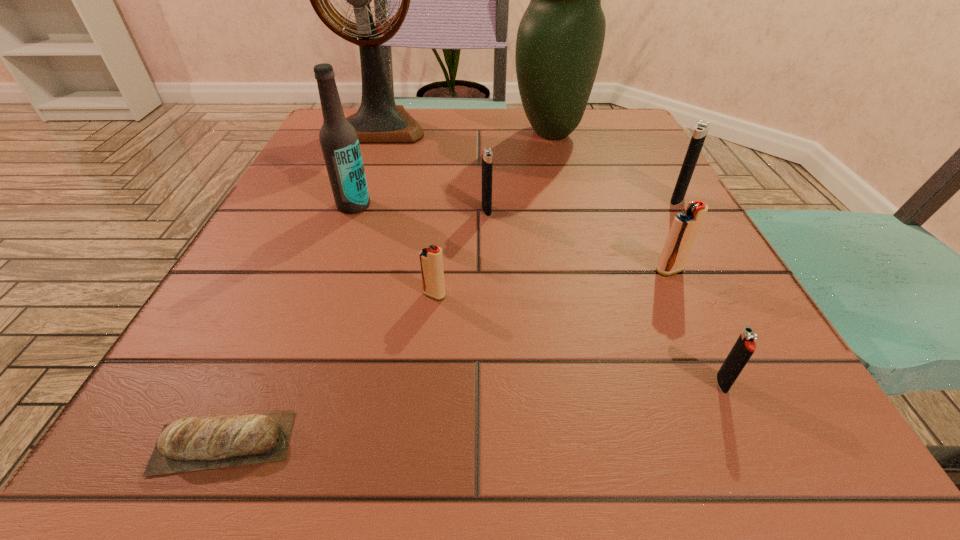
The width and height of the screenshot is (960, 540). I want to click on free space at the far right corner of the desktop, so click(621, 133).

Identify the location of free space at the near right corner. (839, 476).

The height and width of the screenshot is (540, 960). I want to click on vacant area between the beer bottle and the second black igniter from left to right, so click(538, 294).

Find the location of a particular element. free spot between the seventh shortest object and the sixth farthest object is located at coordinates (512, 238).

Where is `free space between the sixth object from left to right and the shortest object`? The width and height of the screenshot is (960, 540). free space between the sixth object from left to right and the shortest object is located at coordinates (387, 288).

This screenshot has height=540, width=960. What are the coordinates of `vacant area between the biggest black igniter and the vase` in the screenshot? It's located at (614, 166).

The height and width of the screenshot is (540, 960). I want to click on free spot between the third nearest object and the fourth nearest object, so click(x=552, y=282).

Locate an element on the screen. empty location between the second smallest black igniter and the nearest black igniter is located at coordinates (605, 296).

At what (x,y) coordinates should I click in order to perform the action: click on empty space that is in between the second tallest object and the shortest object. Please return your answer as a coordinate pair (x, y). Looking at the image, I should click on point(387,288).

You are a GUI agent. You are given a task and a screenshot of the screen. Output one action in this format:
    pyautogui.click(x=<x>, y=<y>)
    Task: Click on the vacant space that is in between the fourth tallest object and the pita bread
    This screenshot has width=960, height=540.
    Given the screenshot: What is the action you would take?
    pyautogui.click(x=450, y=321)